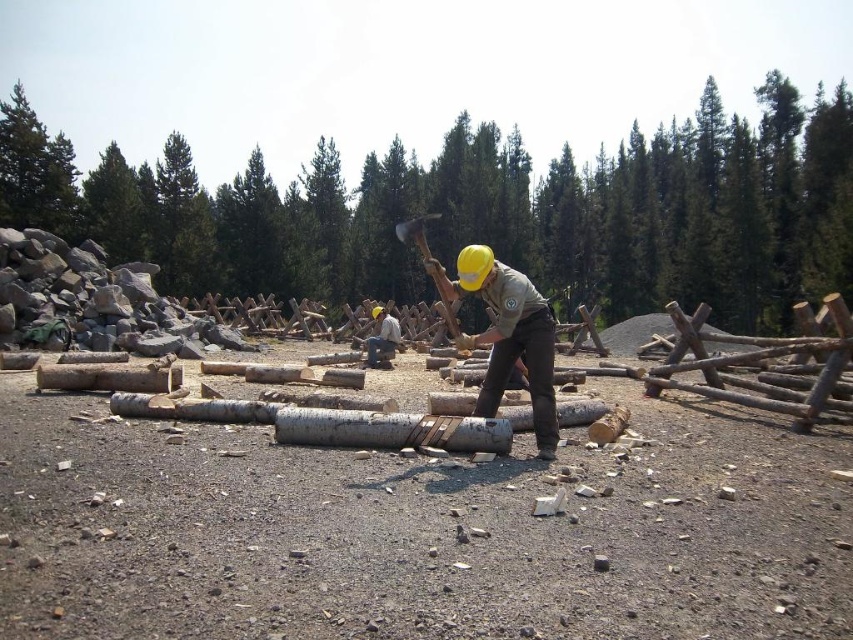
Question: Can you confirm if green rough bark tree at upper left is thinner than wooden hatchet at center?

Choices:
 (A) yes
 (B) no

Answer: (B)

Question: Observing the image, what is the correct spatial positioning of smooth wooden logs at center in reference to green rough bark tree at upper left?

Choices:
 (A) above
 (B) below

Answer: (A)

Question: Which object is positioned farthest from the smooth wooden logs at center?

Choices:
 (A) wooden hatchet at center
 (B) green rough bark tree at upper left

Answer: (B)

Question: Based on their relative distances, which object is farther from the smooth wooden logs at center?

Choices:
 (A) green rough bark tree at upper left
 (B) wooden hatchet at center

Answer: (A)

Question: Which of these objects is positioned farthest from the smooth wooden logs at center?

Choices:
 (A) wooden hatchet at center
 (B) green rough bark tree at upper left

Answer: (B)

Question: Can you confirm if smooth wooden logs at center is positioned to the right of wooden hatchet at center?

Choices:
 (A) no
 (B) yes

Answer: (A)